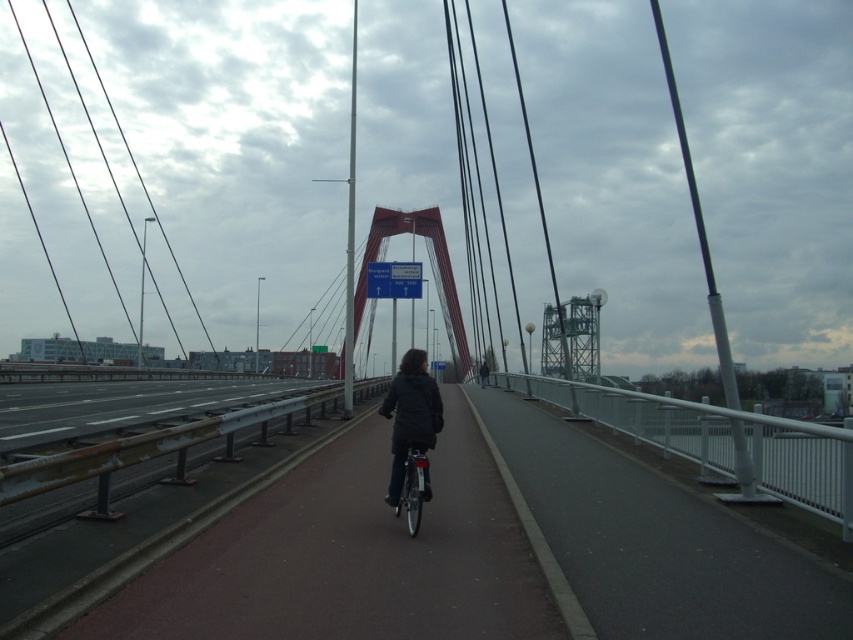
Question: Which point is closer to the camera?

Choices:
 (A) white plastic sign at center
 (B) dark matte jacket at center
 (C) dark gray jacket at center

Answer: (B)

Question: Is white plastic sign at center closer to the viewer compared to dark gray jacket at center?

Choices:
 (A) no
 (B) yes

Answer: (B)

Question: Does white plastic sign at center lie in front of dark gray jacket at center?

Choices:
 (A) yes
 (B) no

Answer: (A)

Question: Can you confirm if dark matte jacket at center is thinner than dark gray jacket at center?

Choices:
 (A) no
 (B) yes

Answer: (B)

Question: Based on their relative distances, which object is farther from the white plastic sign at center?

Choices:
 (A) dark matte jacket at center
 (B) dark gray jacket at center

Answer: (A)

Question: Which point is farther from the camera taking this photo?

Choices:
 (A) 438,424
 (B) 480,376

Answer: (B)